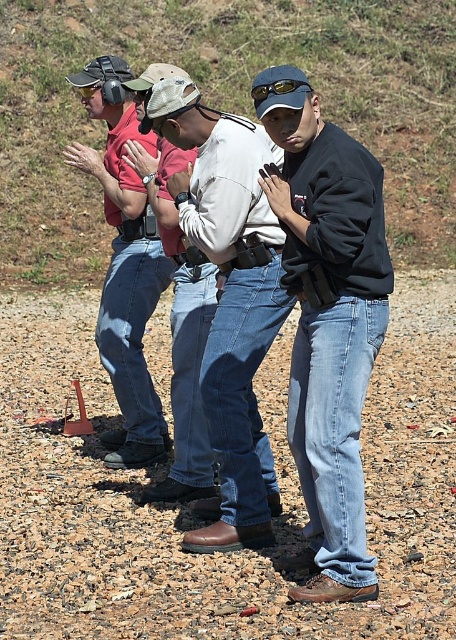
You are a photographer trying to capture a candid shot of the group. You notice the black matte jacket at center and the sunglassestransparent at center. Which object is positioned more to the right side of the scene?

The black matte jacket at center is positioned to the right of the sunglassestransparent at center, so it is more to the right side of the scene.

You are a photographer setting up a shot of the group. You need to ensure that the black matte jacket at center and the sunglassestransparent at center are both in focus. Given that your camera can only focus on objects within a 30 cm width range, can you capture both items in focus?

The black matte jacket at center might be wider than sunglassestransparent at center, but without exact measurements, it is uncertain if their widths fall within the 30 cm focus range. Adjust the camera settings or reposition to ensure both are within the required range.

You are standing on the ground in the image. Where exactly is the dirt gravel at lower center located?

The dirt gravel at lower center is located at point (185, 508).